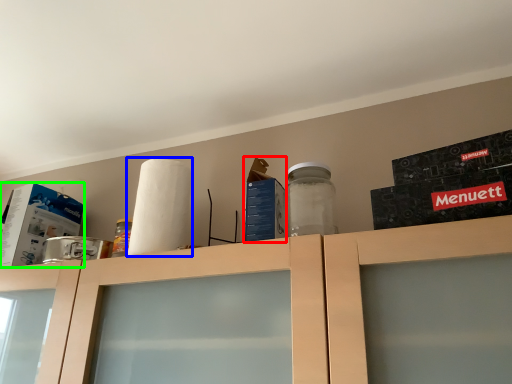
Question: Which object is the farthest from box (highlighted by a red box)? Choose among these: paper towel (highlighted by a blue box) or box (highlighted by a green box).

Choices:
 (A) paper towel
 (B) box

Answer: (B)